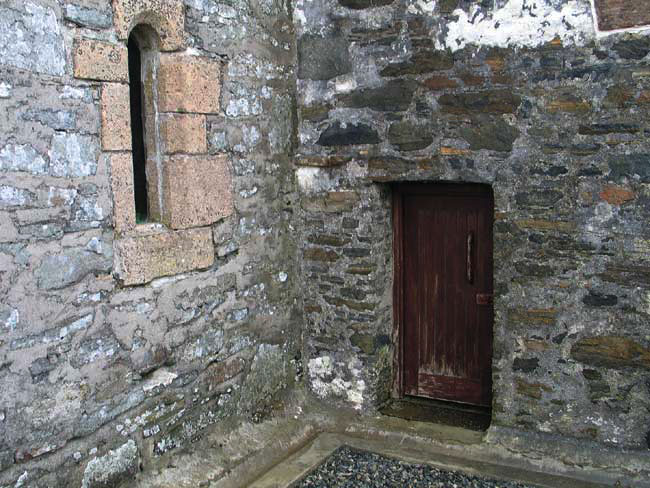
The height and width of the screenshot is (488, 650). I want to click on window, so click(x=156, y=136).